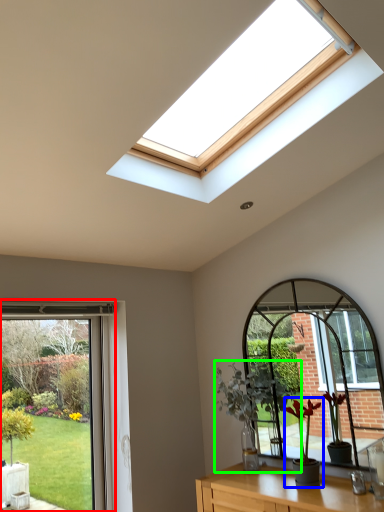
Question: Which object is positioned farthest from window (highlighted by a red box)? Select from houseplant (highlighted by a blue box) and houseplant (highlighted by a green box).

Choices:
 (A) houseplant
 (B) houseplant

Answer: (A)